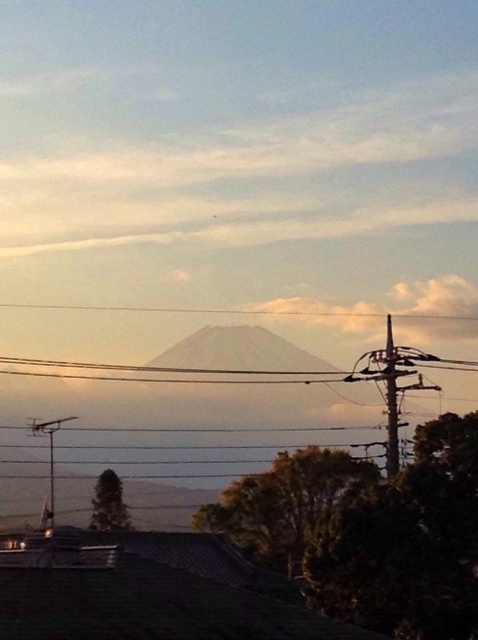
Can you confirm if white fluffy cloud at upper center is positioned to the left of metallic wire at right?

Correct, you'll find white fluffy cloud at upper center to the left of metallic wire at right.

Can you confirm if white fluffy cloud at upper center is shorter than metallic wire at right?

In fact, white fluffy cloud at upper center may be taller than metallic wire at right.

Between point (431, 192) and point (354, 378), which one is positioned in front?

Point (354, 378) is in front.

Locate an element on the screen. white fluffy cloud at upper center is located at coordinates (249, 176).

Does metallic wire at right appear on the left side of metallic gray telegraph pole at left?

No, metallic wire at right is not to the left of metallic gray telegraph pole at left.

Does metallic wire at right appear on the right side of metallic gray telegraph pole at left?

Yes, metallic wire at right is to the right of metallic gray telegraph pole at left.

Who is more forward, (x=390, y=440) or (x=47, y=428)?

Point (x=390, y=440)

At what (x,y) coordinates should I click in order to perform the action: click on metallic wire at right. Please return your answer as a coordinate pair (x, y). Looking at the image, I should click on (391, 385).

In the scene shown: Who is more distant from viewer, (29, 237) or (54, 420)?

Point (29, 237)

The height and width of the screenshot is (640, 478). I want to click on white fluffy cloud at upper center, so click(249, 176).